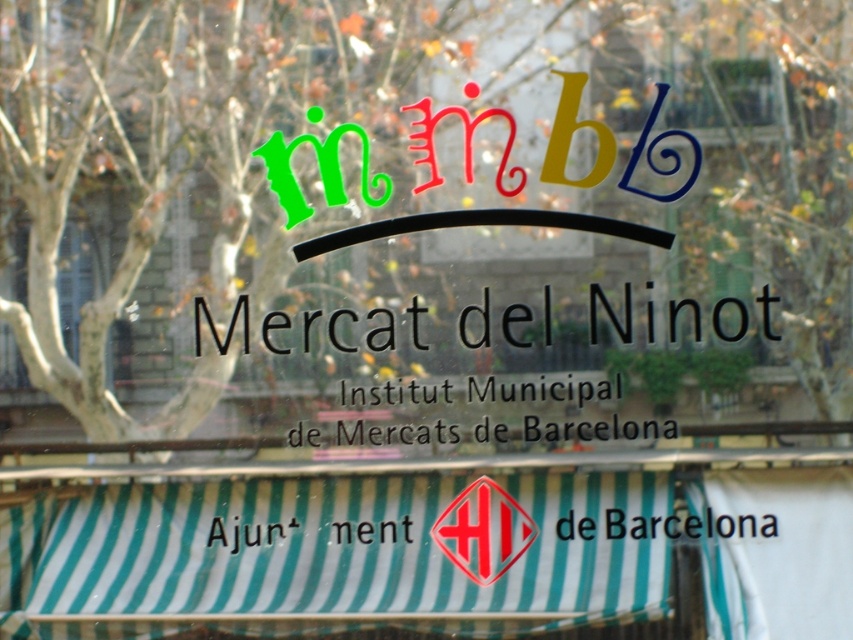
Question: Does red glossy diamond at center lie behind transparent glass at upper left?

Choices:
 (A) no
 (B) yes

Answer: (A)

Question: Among these objects, which one is nearest to the camera?

Choices:
 (A) black matte mercat del ninot at center
 (B) green striped awning at lower center
 (C) transparent glass sign at center

Answer: (B)

Question: Which object appears closest to the camera in this image?

Choices:
 (A) black matte mercat del ninot at center
 (B) black paper at lower center
 (C) transparent glass at upper left
 (D) green striped awning at lower center

Answer: (D)

Question: Is transparent glass sign at center thinner than transparent glass at upper left?

Choices:
 (A) yes
 (B) no

Answer: (B)

Question: Observing the image, what is the correct spatial positioning of transparent glass at upper left in reference to black paper at lower center?

Choices:
 (A) below
 (B) above

Answer: (B)

Question: Based on their relative distances, which object is nearer to the black matte mercat del ninot at center?

Choices:
 (A) black paper at lower center
 (B) green striped awning at lower center

Answer: (B)